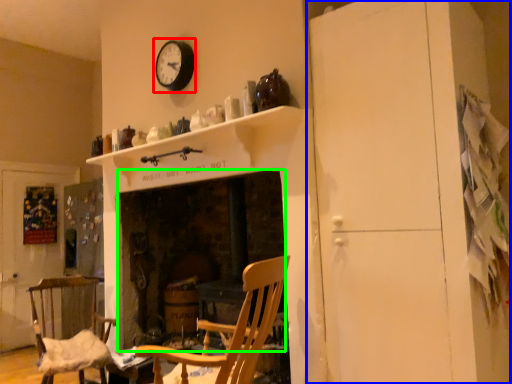
Question: Which object is the farthest from clock (highlighted by a red box)? Choose among these: dresser (highlighted by a blue box) or fireplace (highlighted by a green box).

Choices:
 (A) dresser
 (B) fireplace

Answer: (A)